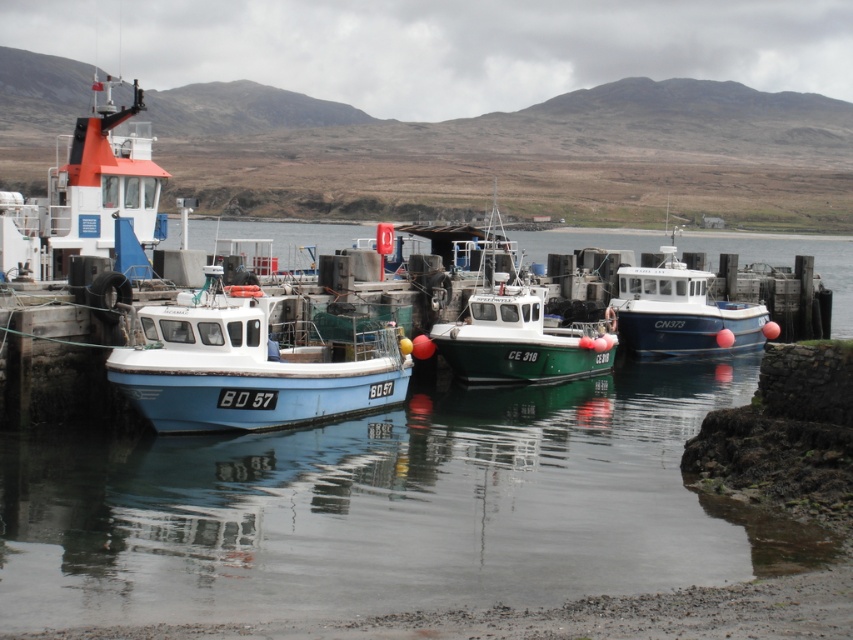
Does light blue matte boat at center have a greater width compared to green matte boat at center?

Incorrect, light blue matte boat at center's width does not surpass green matte boat at center's.

Which is behind, point (294, 410) or point (483, 355)?

Point (483, 355)

What are the coordinates of `light blue matte boat at center` in the screenshot? It's located at (247, 365).

Is green matte boat at center to the left of blue glossy boat at center from the viewer's perspective?

Indeed, green matte boat at center is positioned on the left side of blue glossy boat at center.

Who is more forward, (491, 378) or (643, 355)?

Positioned in front is point (491, 378).

Identify the location of green matte boat at center. The height and width of the screenshot is (640, 853). (515, 326).

From the picture: Does clear water at center appear on the right side of green matte boat at center?

No, clear water at center is not to the right of green matte boat at center.

Can you confirm if clear water at center is positioned below green matte boat at center?

Yes, clear water at center is below green matte boat at center.

Is point (566, 234) closer to camera compared to point (514, 253)?

No, (566, 234) is behind (514, 253).

At what (x,y) coordinates should I click in order to perform the action: click on clear water at center. Please return your answer as a coordinate pair (x, y). Looking at the image, I should click on (386, 508).